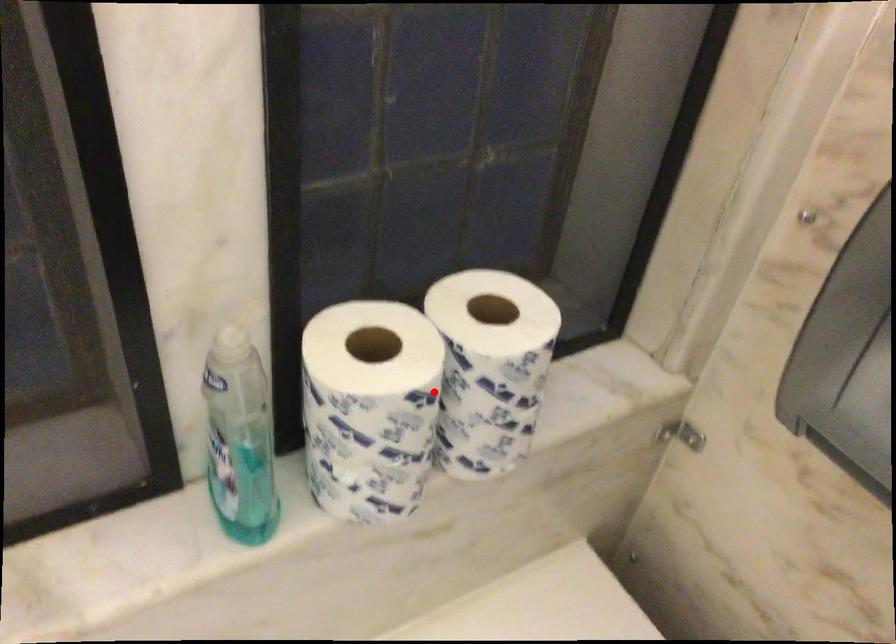
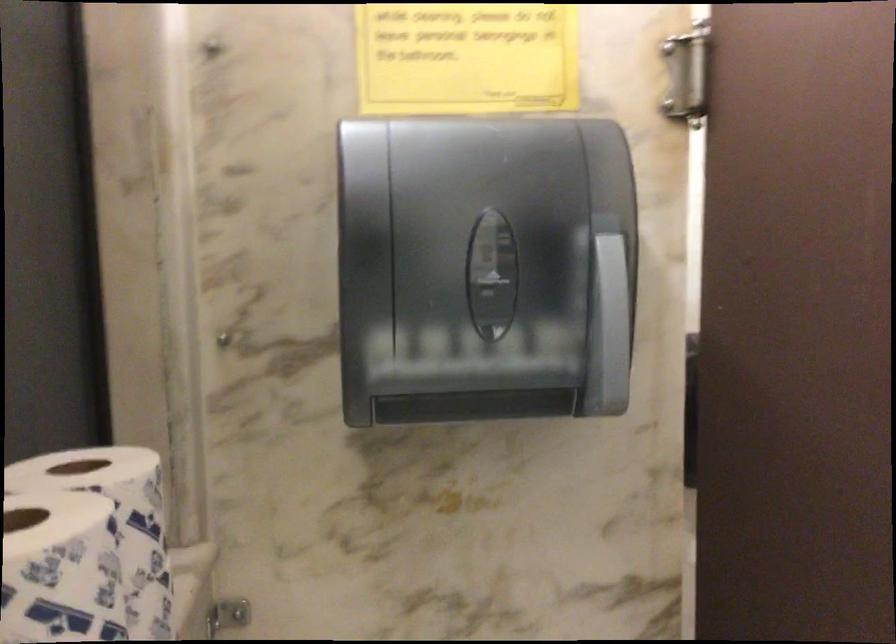
Question: I am providing you with two images of the same scene from different viewpoints. Given a red point in image1, look at the same physical point in image2. Is it:

Choices:
 (A) Closer to the viewpoint
 (B) Farther from the viewpoint

Answer: (A)